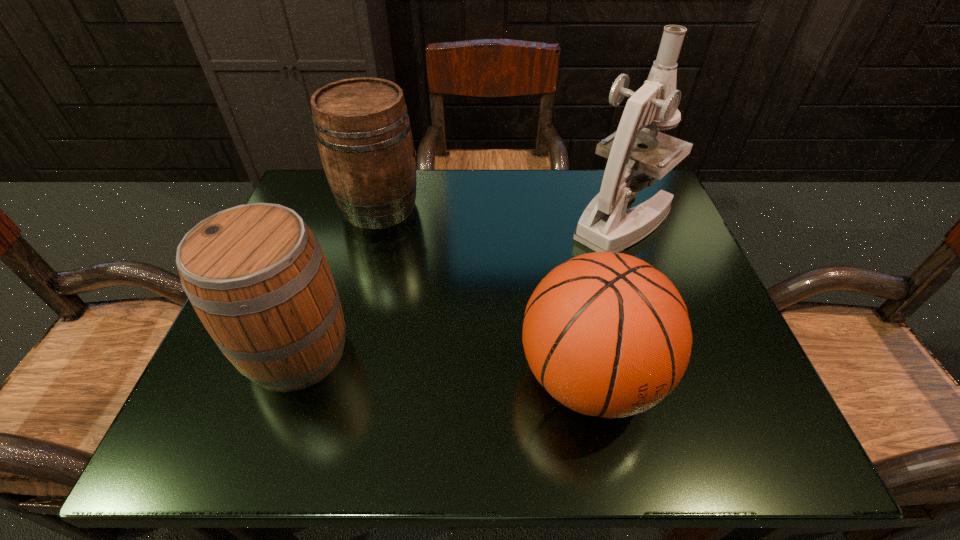
The image size is (960, 540). I want to click on free spot between the nearer cider and the farther cider, so click(339, 279).

What are the coordinates of `vacant space that is in between the farther cider and the microscope` in the screenshot? It's located at (500, 214).

Identify which object is the second nearest to the microscope. Please provide its 2D coordinates. Your answer should be formatted as a tuple, i.e. [(x, y)], where the tuple contains the x and y coordinates of a point satisfying the conditions above.

[(363, 132)]

Identify the location of object that can be found as the closest to the farther cider. Image resolution: width=960 pixels, height=540 pixels. (255, 274).

This screenshot has width=960, height=540. Find the location of `vacant area that satisfies the following two spatial constraints: 1. on the front side of the nearer cider; 2. on the right side of the basketball`. vacant area that satisfies the following two spatial constraints: 1. on the front side of the nearer cider; 2. on the right side of the basketball is located at coordinates (288, 377).

This screenshot has width=960, height=540. What are the coordinates of `blank space that satisfies the following two spatial constraints: 1. on the side of the farther cider near the bung hole; 2. on the right side of the microscope` in the screenshot? It's located at [375, 221].

At what (x,y) coordinates should I click in order to perform the action: click on free region that satisfies the following two spatial constraints: 1. on the back side of the tallest object; 2. on the right side of the nearer cider. Please return your answer as a coordinate pair (x, y). The height and width of the screenshot is (540, 960). Looking at the image, I should click on (342, 221).

Identify the location of vacant space that satisfies the following two spatial constraints: 1. on the side of the farther cider near the bung hole; 2. on the front side of the nearer cider. (342, 351).

The image size is (960, 540). Find the location of `vacant area that satisfies the following two spatial constraints: 1. on the back side of the nearer cider; 2. on the left side of the microscope`. vacant area that satisfies the following two spatial constraints: 1. on the back side of the nearer cider; 2. on the left side of the microscope is located at coordinates (342, 221).

You are a GUI agent. You are given a task and a screenshot of the screen. Output one action in this format:
    pyautogui.click(x=<x>, y=<y>)
    Task: Click on the free location that satisfies the following two spatial constraints: 1. on the side of the microscope near the bung hole; 2. on the left side of the farther cider
    This screenshot has height=540, width=960.
    Given the screenshot: What is the action you would take?
    pyautogui.click(x=375, y=221)